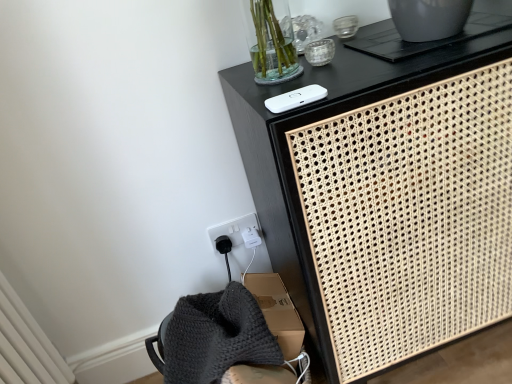
Image resolution: width=512 pixels, height=384 pixels. In order to click on white woven cabinet at upper right in this screenshot , I will do `click(386, 198)`.

What do you see at coordinates (386, 198) in the screenshot? I see `white woven cabinet at upper right` at bounding box center [386, 198].

In order to face white matte ipod at upper center, should I rotate leftwards or rightwards?

You should rotate right by 5.814 degrees.

Image resolution: width=512 pixels, height=384 pixels. What do you see at coordinates (295, 98) in the screenshot?
I see `white matte ipod at upper center` at bounding box center [295, 98].

What is the approximate height of white matte ipod at upper center?

1.67 inches.

The image size is (512, 384). I want to click on white matte ipod at upper center, so click(x=295, y=98).

The height and width of the screenshot is (384, 512). I want to click on white woven cabinet at upper right, so click(386, 198).

Is white matte ipod at upper center to the left or to the right of white woven cabinet at upper right in the image?

Clearly, white matte ipod at upper center is on the left of white woven cabinet at upper right in the image.

Is the position of white matte ipod at upper center less distant than that of white woven cabinet at upper right?

No, white matte ipod at upper center is behind white woven cabinet at upper right.

Does point (274, 113) come behind point (399, 265)?

No, (274, 113) is in front of (399, 265).

From the image's perspective, is white matte ipod at upper center on white woven cabinet at upper right?

Yes.

From a real-world perspective, does white matte ipod at upper center stand above white woven cabinet at upper right?

Yes, from a real-world perspective, white matte ipod at upper center is over white woven cabinet at upper right

Can you confirm if white matte ipod at upper center is thinner than white woven cabinet at upper right?

Indeed, white matte ipod at upper center has a lesser width compared to white woven cabinet at upper right.

Is white matte ipod at upper center shorter than white woven cabinet at upper right?

Indeed, white matte ipod at upper center has a lesser height compared to white woven cabinet at upper right.

Consider the image. In terms of size, does white matte ipod at upper center appear bigger or smaller than white woven cabinet at upper right?

In the image, white matte ipod at upper center appears to be smaller than white woven cabinet at upper right.

Is white matte ipod at upper center situated inside white woven cabinet at upper right or outside?

white matte ipod at upper center is located inside white woven cabinet at upper right.

Would you say white matte ipod at upper center is a long distance from white woven cabinet at upper right?

white matte ipod at upper center is near white woven cabinet at upper right, not far away.

Is white matte ipod at upper center oriented towards white woven cabinet at upper right?

No, white matte ipod at upper center is not aimed at white woven cabinet at upper right.

How different are the orientations of white matte ipod at upper center and white woven cabinet at upper right in degrees?

white matte ipod at upper center and white woven cabinet at upper right are facing 2.69 degrees away from each other.

The height and width of the screenshot is (384, 512). In order to click on furniture below the white matte ipod at upper center (from the image's perspective) in this screenshot , I will do `click(386, 198)`.

Is white woven cabinet at upper right to the left of white matte ipod at upper center from the viewer's perspective?

Incorrect, white woven cabinet at upper right is not on the left side of white matte ipod at upper center.

Is white woven cabinet at upper right further to camera compared to white matte ipod at upper center?

No, the depth of white woven cabinet at upper right is less than that of white matte ipod at upper center.

Is point (409, 250) closer or farther from the camera than point (279, 100)?

Point (409, 250) appears to be farther away from the viewer than point (279, 100).

From the image's perspective, is white woven cabinet at upper right located above or below white matte ipod at upper center?

white woven cabinet at upper right is below white matte ipod at upper center.

From a real-world perspective, is white woven cabinet at upper right positioned above or below white matte ipod at upper center?

Clearly, from a real-world perspective, white woven cabinet at upper right is below white matte ipod at upper center.

Which of these two, white woven cabinet at upper right or white matte ipod at upper center, is wider?

white woven cabinet at upper right is wider.

Considering the relative sizes of white woven cabinet at upper right and white matte ipod at upper center in the image provided, is white woven cabinet at upper right taller than white matte ipod at upper center?

Yes.

Is white woven cabinet at upper right bigger than white matte ipod at upper center?

Yes.

Is white woven cabinet at upper right inside the boundaries of white matte ipod at upper center, or outside?

white woven cabinet at upper right is not enclosed by white matte ipod at upper center.

Does white woven cabinet at upper right touch white matte ipod at upper center?

No, white woven cabinet at upper right is not in contact with white matte ipod at upper center.

Is white woven cabinet at upper right looking in the opposite direction of white matte ipod at upper center?

No, white matte ipod at upper center is not at the back of white woven cabinet at upper right.

How much distance is there between white woven cabinet at upper right and white matte ipod at upper center?

white woven cabinet at upper right and white matte ipod at upper center are 35.20 centimeters apart from each other.

This screenshot has height=384, width=512. Find the location of `furniture that appears below the white matte ipod at upper center (from the image's perspective)`. furniture that appears below the white matte ipod at upper center (from the image's perspective) is located at coordinates (386, 198).

Image resolution: width=512 pixels, height=384 pixels. Identify the location of furniture in front of the white matte ipod at upper center. (386, 198).

At what (x,y) coordinates should I click in order to perform the action: click on ipod located on the left of white woven cabinet at upper right. Please return your answer as a coordinate pair (x, y). The image size is (512, 384). Looking at the image, I should click on (295, 98).